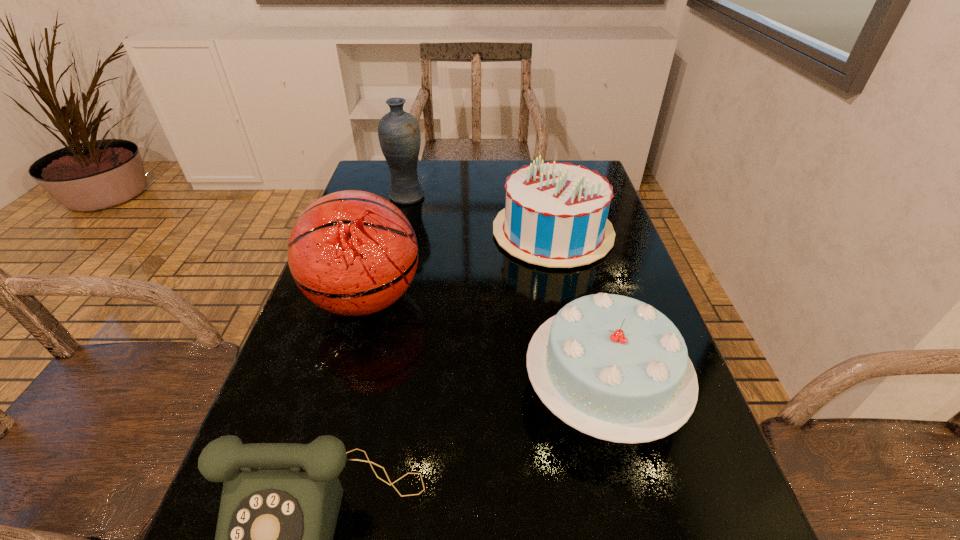
Where is `basketball located in the left edge section of the desktop`? The width and height of the screenshot is (960, 540). basketball located in the left edge section of the desktop is located at coordinates (353, 253).

Where is `object that is at the far left corner`? object that is at the far left corner is located at coordinates (399, 135).

Locate an element on the screen. free space at the far edge is located at coordinates (520, 164).

In the image, there is a desktop. Identify the location of vacant space at the left edge. The width and height of the screenshot is (960, 540). (312, 357).

Where is `vacant space at the right edge of the desktop`? The height and width of the screenshot is (540, 960). vacant space at the right edge of the desktop is located at coordinates (617, 226).

Find the location of a particular element. This screenshot has height=540, width=960. vacant space in between the vase and the nearer birthday cake is located at coordinates (505, 294).

I want to click on blank region between the vase and the nearer birthday cake, so click(505, 294).

In order to click on free space between the nearer birthday cake and the vase in this screenshot , I will do `click(505, 294)`.

I want to click on object that stands as the fourth closest to the nearer birthday cake, so (x=399, y=135).

Select which object is the second closest to the basketball. Please provide its 2D coordinates. Your answer should be formatted as a tuple, i.e. [(x, y)], where the tuple contains the x and y coordinates of a point satisfying the conditions above.

[(613, 367)]